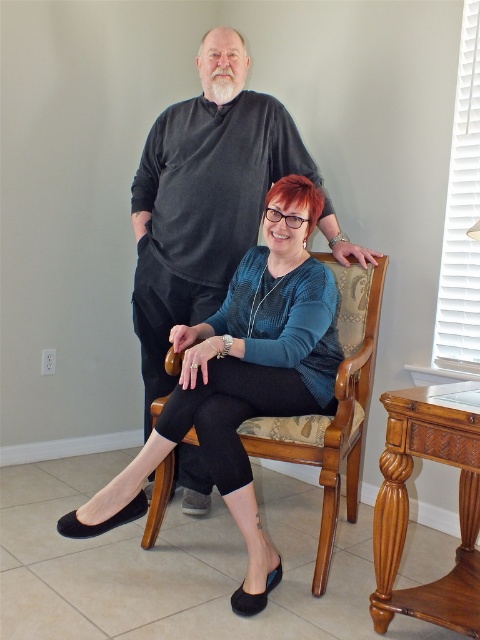
Does point (224, 113) lie behind point (158, 401)?

Yes.

Between point (227, 198) and point (348, 387), which one is positioned in front?

Point (348, 387) is more forward.

Find the location of a particular element. dark gray sweater at center is located at coordinates (204, 198).